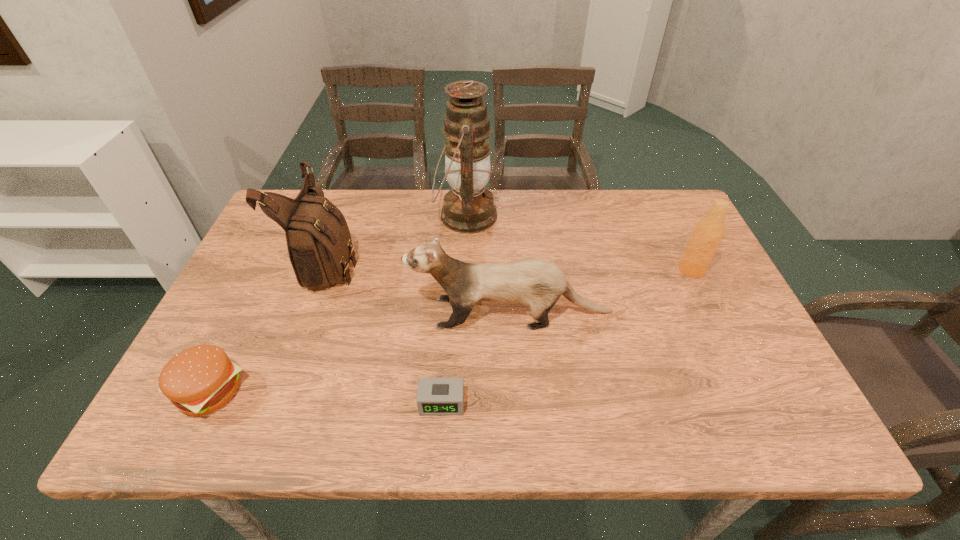
Where is `lantern`? Image resolution: width=960 pixels, height=540 pixels. lantern is located at coordinates (468, 208).

Where is `the fifth shortest object`? Image resolution: width=960 pixels, height=540 pixels. the fifth shortest object is located at coordinates (319, 243).

Where is `beer bottle`? beer bottle is located at coordinates (708, 233).

At what (x,y) coordinates should I click in order to perform the action: click on ferret. Please return your answer as a coordinate pair (x, y). This screenshot has width=960, height=540. Looking at the image, I should click on (538, 284).

Identify the location of the fifth tallest object. The height and width of the screenshot is (540, 960). (199, 380).

The width and height of the screenshot is (960, 540). In order to click on alarm clock in this screenshot , I will do `click(436, 396)`.

At what (x,y) coordinates should I click in order to perform the action: click on blank area located 0.100m on the front of the lantern. Please return your answer as a coordinate pair (x, y). The image size is (960, 540). Looking at the image, I should click on coord(464,268).

The height and width of the screenshot is (540, 960). Find the location of `free space located 0.210m on the front-facing side of the second tallest object`. free space located 0.210m on the front-facing side of the second tallest object is located at coordinates (437, 261).

At what (x,y) coordinates should I click in order to perform the action: click on free region located 0.180m on the left of the beer bottle. Please return your answer as a coordinate pair (x, y). The image size is (960, 540). Looking at the image, I should click on (611, 270).

What are the coordinates of `free region located 0.370m on the face of the ferret` in the screenshot? It's located at (255, 313).